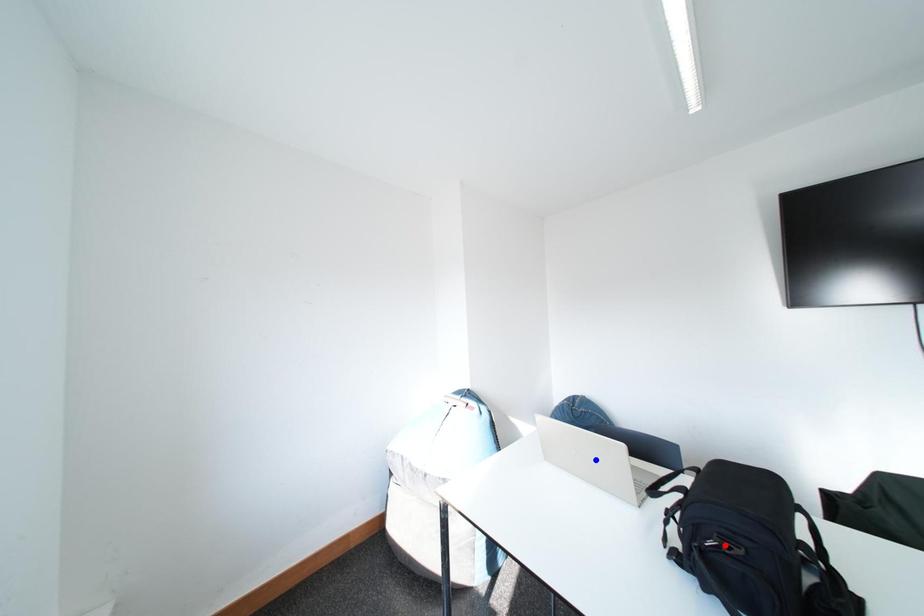
Question: In the image, two points are highlighted. Which point is nearer to the camera? Reply with the corresponding letter.

Choices:
 (A) blue point
 (B) red point

Answer: (B)